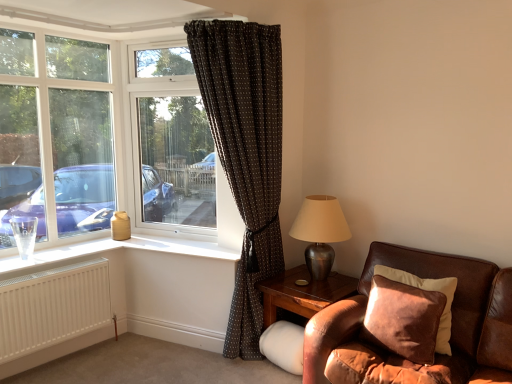
Identify the location of vacant region under white matte radiator at lower left (from a real-world perspective). (58, 365).